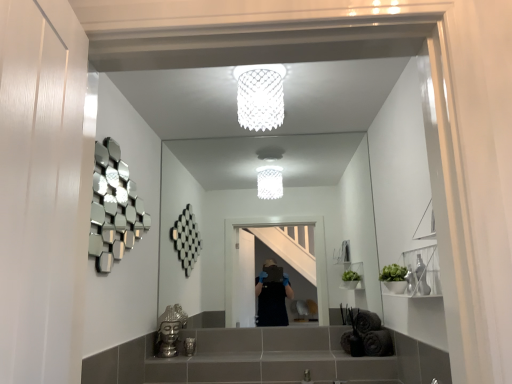
Question: From their relative heights in the image, would you say metallic silver toiletry at lower center is taller or shorter than clear glass mirror at center?

Choices:
 (A) short
 (B) tall

Answer: (A)

Question: Considering their positions, is metallic silver toiletry at lower center located in front of or behind clear glass mirror at center?

Choices:
 (A) behind
 (B) front

Answer: (B)

Question: Estimate the real-world distances between objects in this image. Which object is closer to the metallic silver toiletry at lower center?

Choices:
 (A) gold metallic buddha head at lower center
 (B) clear glass mirror at center
 (C) white mesh light fixture at upper center

Answer: (A)

Question: Which is farther from the clear glass mirror at center?

Choices:
 (A) gold metallic buddha head at lower center
 (B) white mesh light fixture at upper center
 (C) metallic silver toiletry at lower center

Answer: (C)